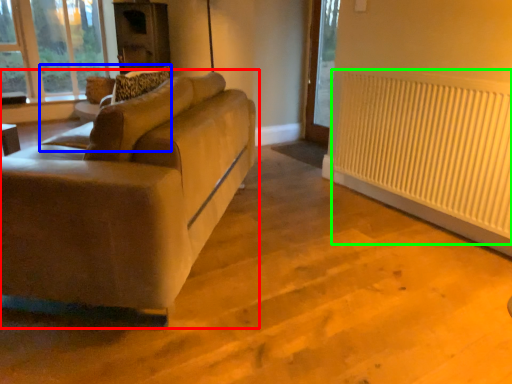
Question: Based on their relative distances, which object is nearer to studio couch (highlighted by a red box)? Choose from swivel chair (highlighted by a blue box) and radiator (highlighted by a green box).

Choices:
 (A) swivel chair
 (B) radiator

Answer: (A)